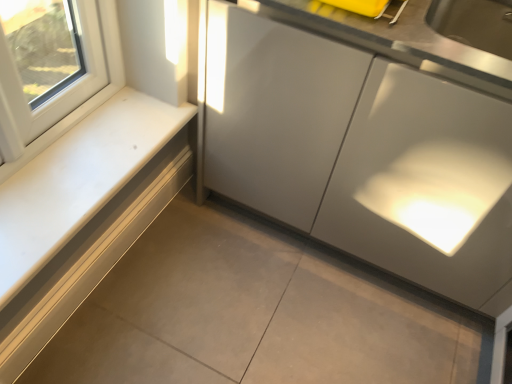
Locate an element on the screen. empty space that is ontop of white glossy countertop at left (from a real-world perspective) is located at coordinates (103, 232).